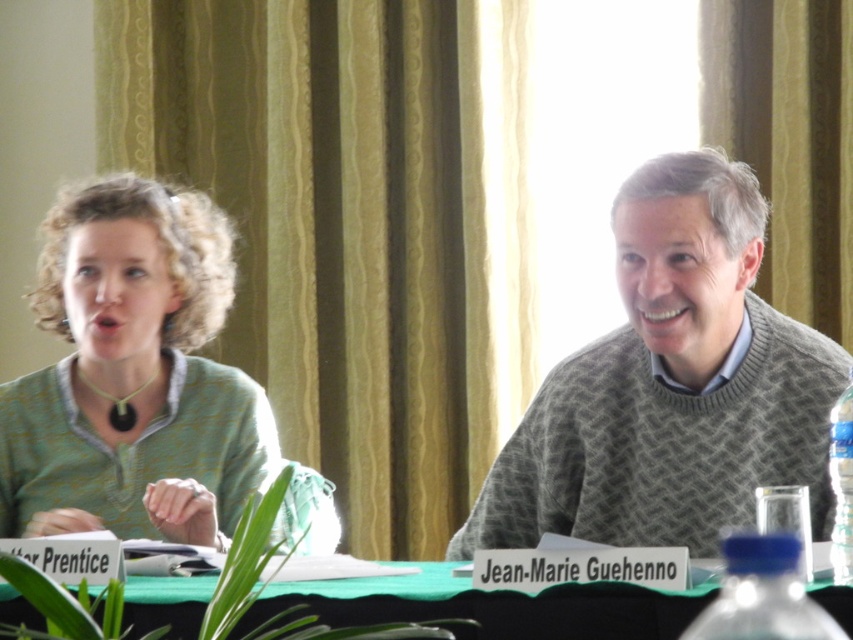
You are an event planner setting up a camera for a formal event. The camera is positioned to focus on the green knitted sweater at upper center. Where should you aim the camera to capture this object?

The camera should be aimed at the coordinates point [671,385] to capture the green knitted sweater at upper center.

Based on the photo, you are a photographer setting up for a group photo. You want to ensure that both the green knitted sweater at upper center and the blue plastic bottle at lower right are visible in the frame. Based on their positions, which object is closer to the camera?

The green knitted sweater at upper center is closer to the camera because the blue plastic bottle at lower right is behind it.